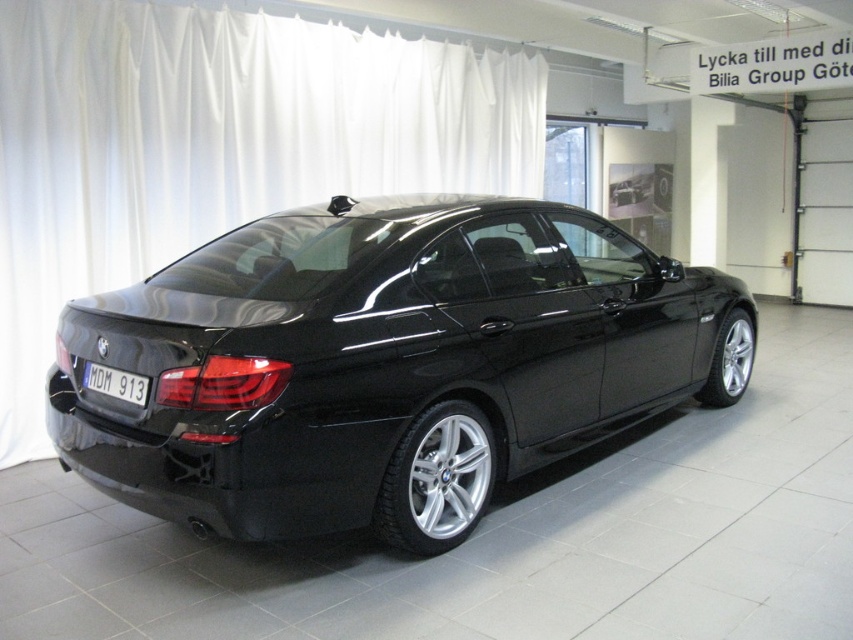
Question: Is the position of white matte curtain at upper center less distant than that of black plastic license plate at lower center?

Choices:
 (A) yes
 (B) no

Answer: (B)

Question: Estimate the real-world distances between objects in this image. Which object is farther from the black glossy sedan at center?

Choices:
 (A) black plastic license plate at lower center
 (B) white matte curtain at upper center

Answer: (B)

Question: Can you confirm if white matte curtain at upper center is positioned above black plastic license plate at lower center?

Choices:
 (A) yes
 (B) no

Answer: (A)

Question: Which object appears closest to the camera in this image?

Choices:
 (A) white matte curtain at upper center
 (B) black plastic license plate at lower center

Answer: (B)

Question: Considering the relative positions of black glossy sedan at center and black plastic license plate at lower center in the image provided, where is black glossy sedan at center located with respect to black plastic license plate at lower center?

Choices:
 (A) above
 (B) below

Answer: (A)

Question: Which point is closer to the camera?

Choices:
 (A) black plastic license plate at lower center
 (B) black glossy sedan at center

Answer: (B)